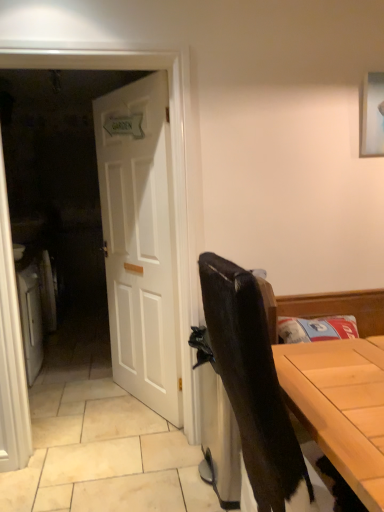
Image resolution: width=384 pixels, height=512 pixels. What do you see at coordinates (173, 172) in the screenshot?
I see `white wooden door at left` at bounding box center [173, 172].

The height and width of the screenshot is (512, 384). I want to click on matte black chair at right, so click(253, 385).

Is white wooden door at center wider than matte black chair at right?

No, white wooden door at center is not wider than matte black chair at right.

Considering the relative sizes of white wooden door at center and matte black chair at right in the image provided, is white wooden door at center smaller than matte black chair at right?

Yes.

Considering the relative sizes of white wooden door at center and matte black chair at right in the image provided, is white wooden door at center taller than matte black chair at right?

Correct, white wooden door at center is much taller as matte black chair at right.

Could you tell me if matte black chair at right is facing white wooden door at center?

No, matte black chair at right does not turn towards white wooden door at center.

Is matte black chair at right directly adjacent to white wooden door at center?

matte black chair at right and white wooden door at center are not in contact.

Relative to white wooden door at center, is matte black chair at right in front or behind?

Clearly, matte black chair at right is in front of white wooden door at center.

Considering the sizes of matte black chair at right and white wooden door at center in the image, is matte black chair at right wider or thinner than white wooden door at center?

In the image, matte black chair at right appears to be wider than white wooden door at center.

From their relative heights in the image, would you say white wooden door at left is taller or shorter than white wooden door at center?

In the image, white wooden door at left appears to be taller than white wooden door at center.

Consider the image. Do you think white wooden door at left is within white wooden door at center, or outside of it?

white wooden door at left cannot be found inside white wooden door at center.

Does white wooden door at left appear on the right side of white wooden door at center?

No, white wooden door at left is not to the right of white wooden door at center.

Is point (180, 234) positioned before point (109, 110)?

Yes, point (180, 234) is in front of point (109, 110).

Is white wooden door at left at the back of white wooden door at center?

Yes, white wooden door at center's orientation is away from white wooden door at left.

Would you say white wooden door at center is inside or outside white wooden door at left?

white wooden door at center is not enclosed by white wooden door at left.

Between white wooden door at center and white wooden door at left, which one has smaller size?

white wooden door at center is smaller.

Is the position of white wooden door at center less distant than that of white wooden door at left?

That is False.

Who is shorter, white wooden door at left or matte black chair at right?

matte black chair at right.

Which object is positioned more to the left, white wooden door at left or matte black chair at right?

white wooden door at left is more to the left.

From the image's perspective, is white wooden door at left located above or below matte black chair at right?

white wooden door at left is situated higher than matte black chair at right in the image.

How many degrees apart are the facing directions of matte black chair at right and white wooden door at left?

The facing directions of matte black chair at right and white wooden door at left are 87.3 degrees apart.

Is matte black chair at right beside white wooden door at left?

No, matte black chair at right is not beside white wooden door at left.

Which is less distant, (243, 275) or (186, 204)?

Point (243, 275).

Which of these two, matte black chair at right or white wooden door at left, stands shorter?

With less height is matte black chair at right.

This screenshot has height=512, width=384. I want to click on chair that appears below the white wooden door at center (from the image's perspective), so click(x=253, y=385).

Find the location of `door above the matte black chair at right (from the image's perspective)`. door above the matte black chair at right (from the image's perspective) is located at coordinates 140,242.

Which object lies nearer to the anchor point matte black chair at right, white wooden door at left or white wooden door at center?

white wooden door at left.

Considering their positions, is white wooden door at left positioned further to white wooden door at center than matte black chair at right?

matte black chair at right lies further to white wooden door at center than the other object.

Based on their spatial positions, is white wooden door at center or white wooden door at left further from matte black chair at right?

Among the two, white wooden door at center is located further to matte black chair at right.

When comparing their distances from white wooden door at center, does matte black chair at right or white wooden door at left seem closer?

Based on the image, white wooden door at left appears to be nearer to white wooden door at center.

Considering their positions, is matte black chair at right positioned further to white wooden door at left than white wooden door at center?

matte black chair at right.

Based on their spatial positions, is white wooden door at center or matte black chair at right further from white wooden door at left?

matte black chair at right lies further to white wooden door at left than the other object.

Image resolution: width=384 pixels, height=512 pixels. What are the coordinates of `screen door positioned between matte black chair at right and white wooden door at center from near to far` in the screenshot? It's located at (173, 172).